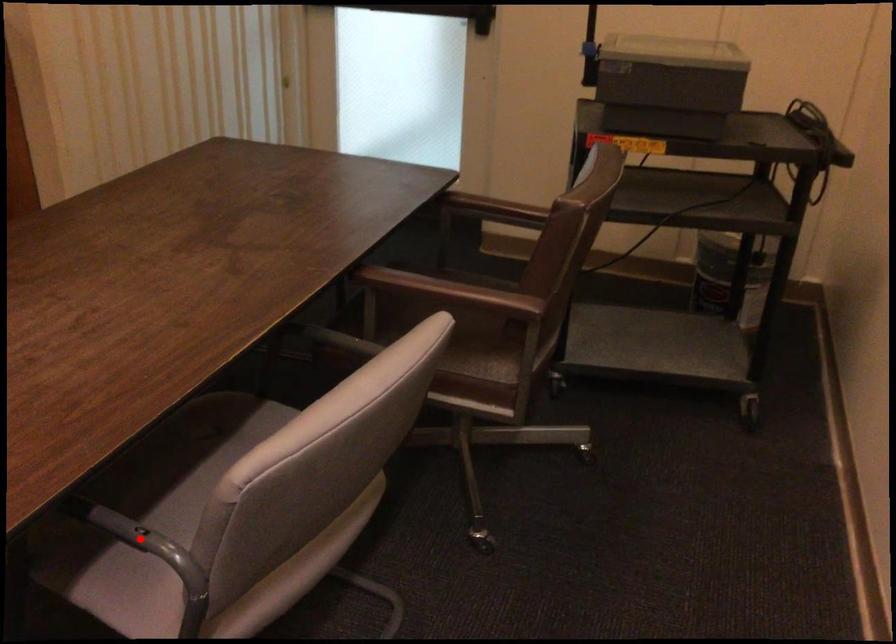
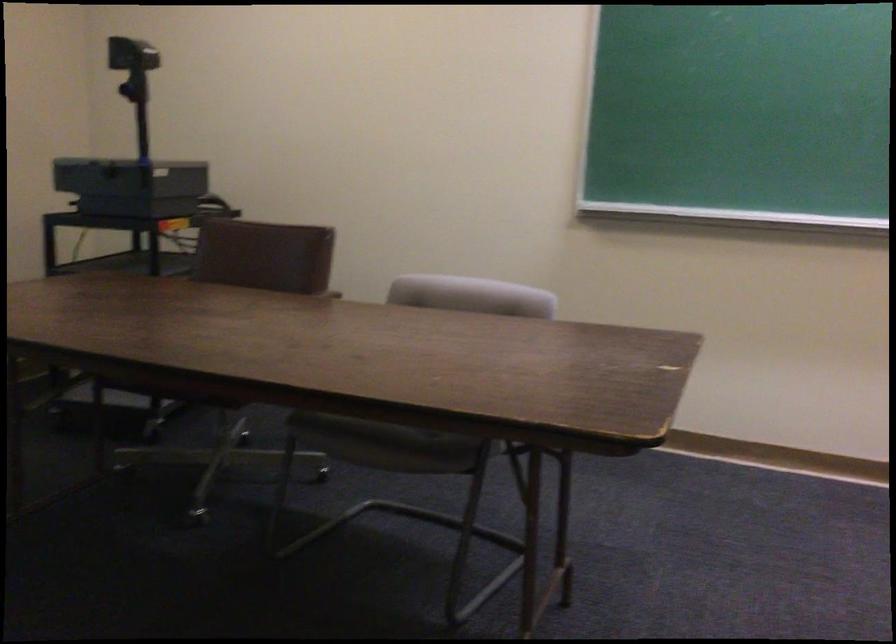
Question: I am providing you with two images of the same scene from different viewpoints. A red point is marked on the first image. At the location where the point appears in image 1, is it still visible in image 2?

Choices:
 (A) Yes
 (B) No

Answer: (B)